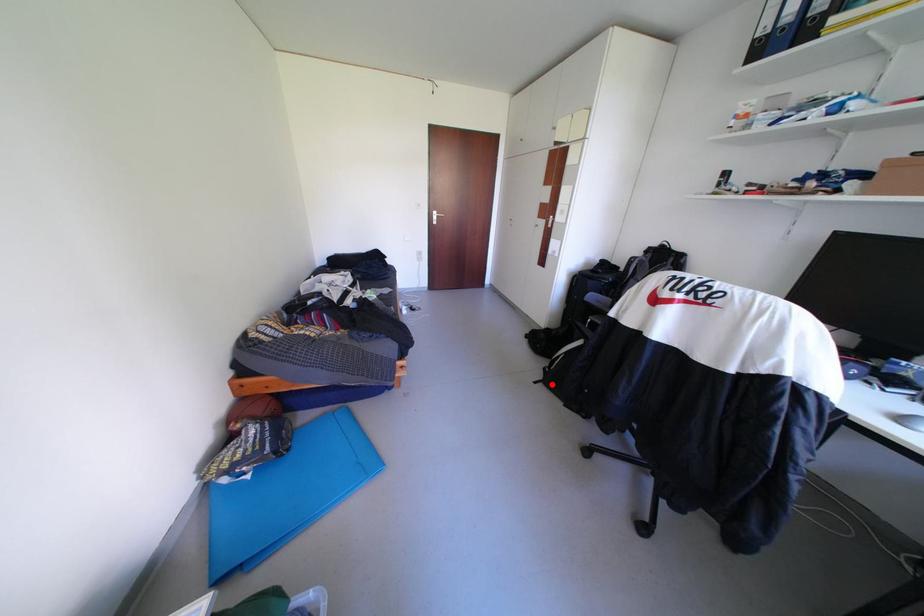
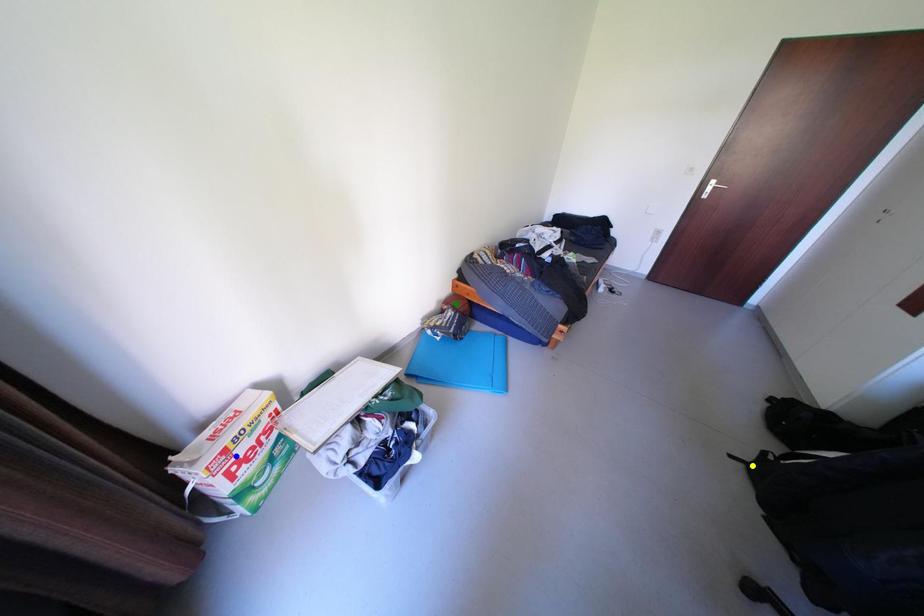
Question: I am providing you with two images of the same scene from different viewpoints. A red point is marked on the first image. You are given multiple points on the second image. Which spot in image 2 lines up with the point in image 1?

Choices:
 (A) blue point
 (B) green point
 (C) yellow point

Answer: (C)